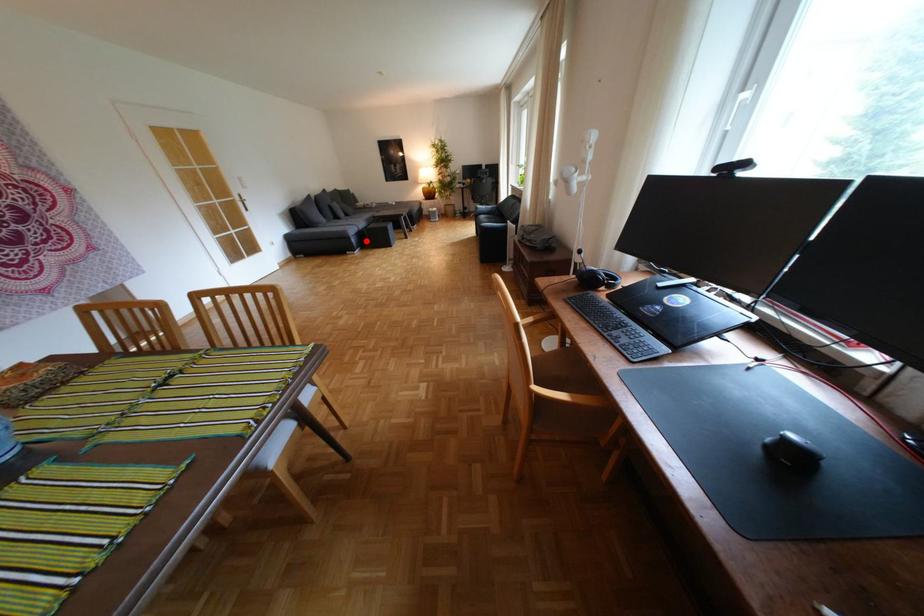
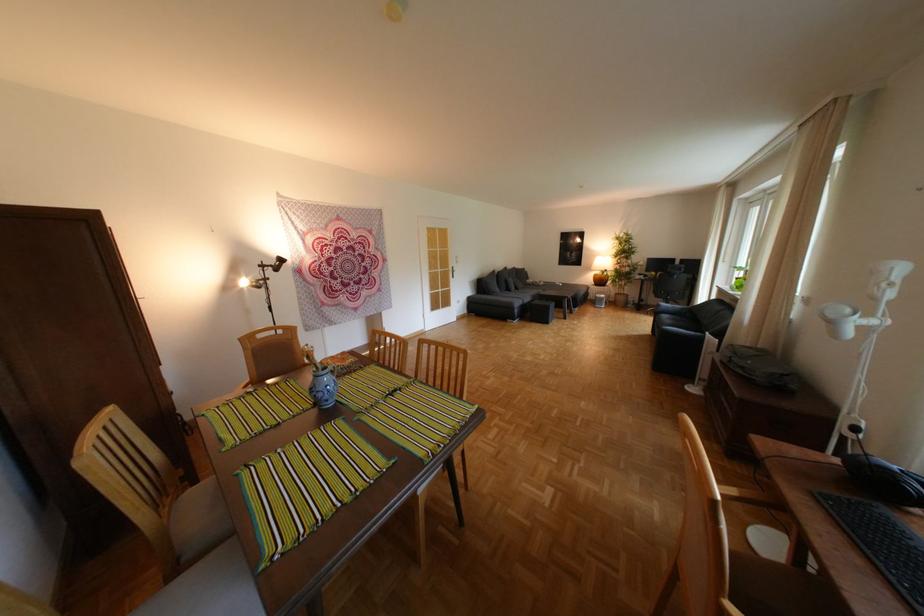
The point at the highlighted location is marked in the first image. Where is the corresponding point in the second image?

(529, 312)